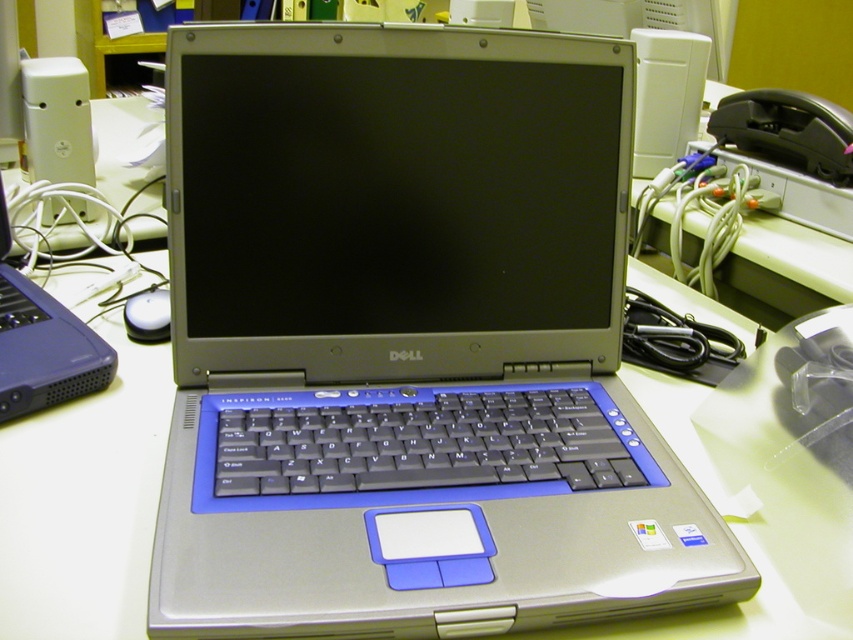
You are a technician working in an office. You need to connect the silver metallic laptop at center to the silver metallic computer monitor at center using a cable that is 1.5 inches long. Will the cable be long enough to reach between the two devices?

The silver metallic laptop at center is 1.34 inches away from the silver metallic computer monitor at center. The cable is 1.5 inches long, which is longer than the distance between them. Therefore, the cable will be long enough to reach between the two devices.

You are setting up a workspace and need to place a wireless charger between the silver metallic laptop at center and the black plastic keyboard at center. The wireless charger has a diameter of 10 centimeters. Is there enough space between them to fit the charger?

The silver metallic laptop at center is 7.10 centimeters away from the black plastic keyboard at center. Since the wireless charger requires 10 centimeters of space, there is not enough room to place it between them.

You are setting up a new laptop on your desk. You have a silver metallic laptop at center and a black plastic keyboard at center. Which object should you place first to ensure proper setup?

The silver metallic laptop at center should be placed first since it is positioned above the black plastic keyboard at center, indicating it needs to be set up in that order.